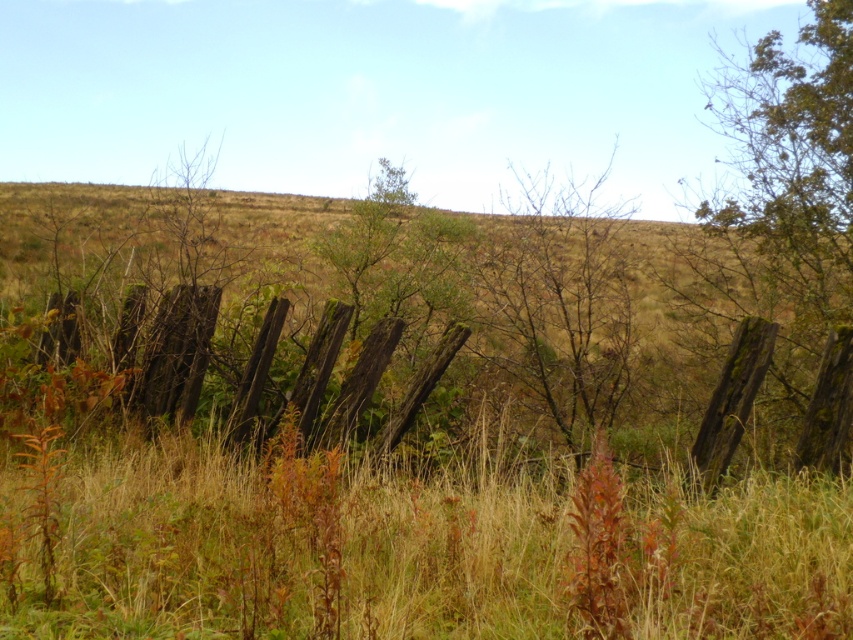
Consider the image. Does weathered wood fence at center appear over bare branches at center?

Actually, weathered wood fence at center is below bare branches at center.

Locate an element on the screen. The image size is (853, 640). weathered wood fence at center is located at coordinates (109, 371).

Identify the location of weathered wood fence at center. (109, 371).

Who is higher up, green mossy fence post at right or weathered wood fence at center?

green mossy fence post at right is higher up.

Is point (741, 356) farther from camera compared to point (172, 312)?

No, it is not.

Is point (840, 164) positioned in front of point (242, 397)?

No, it is not.

The width and height of the screenshot is (853, 640). What are the coordinates of `green mossy fence post at right` in the screenshot? It's located at (782, 234).

Can you confirm if green mossy fence post at right is wider than bare branches at center?

Yes.

Is point (831, 253) farther from camera compared to point (515, 342)?

No.

Locate an element on the screen. The width and height of the screenshot is (853, 640). green mossy fence post at right is located at coordinates [x=782, y=234].

Locate an element on the screen. green mossy fence post at right is located at coordinates (782, 234).